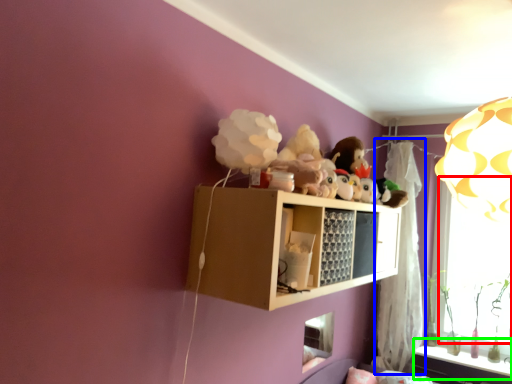
Question: Which object is positioned closest to window screen (highlighted by a red box)? Select from curtain (highlighted by a blue box) and window sill (highlighted by a green box).

Choices:
 (A) curtain
 (B) window sill

Answer: (A)